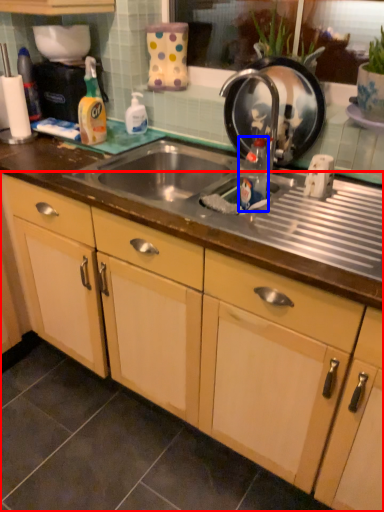
Question: Which of the following is the farthest to the observer, cabinetry (highlighted by a red box) or bottle (highlighted by a blue box)?

Choices:
 (A) cabinetry
 (B) bottle

Answer: (B)